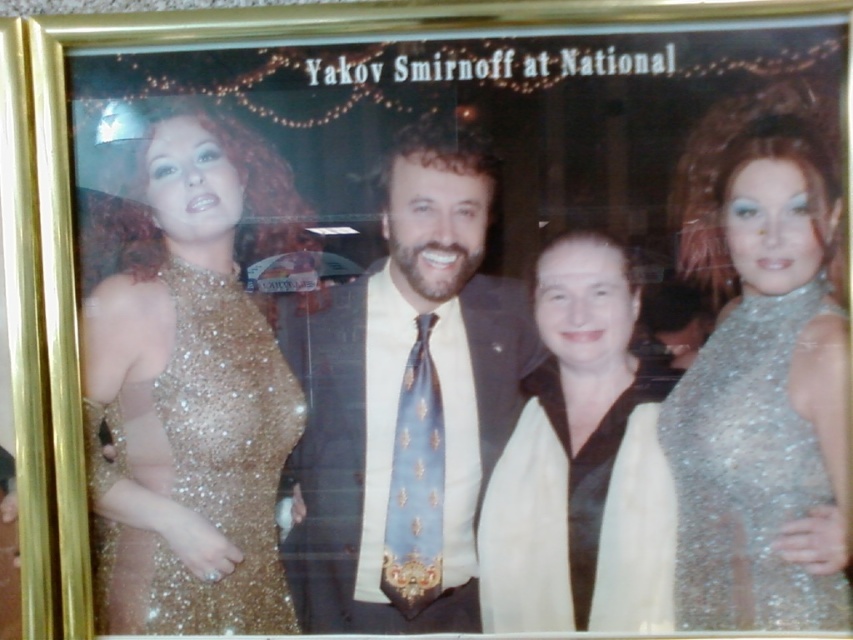
You are a photographer who wants to adjust the lighting to highlight both the sparkly gold dress at left and the sparkly silver dress at right equally. Considering their positions, which dress might require more direct light to achieve this?

The sparkly gold dress at left is closer to the viewer than the sparkly silver dress at right, so it might require less direct light to achieve the same level of highlight since it is already in a position where light can reach it more effectively.

You are a photographer adjusting the lighting for a group photo. You notice the sparkly gold dress at left and the light blue silk tie at center. Which object might require more focused lighting to avoid glare? Explain your reasoning based on their sizes.

The sparkly gold dress at left requires more focused lighting because its width is larger than the light blue silk tie at center, making it more prone to creating broader and more intense glare areas.